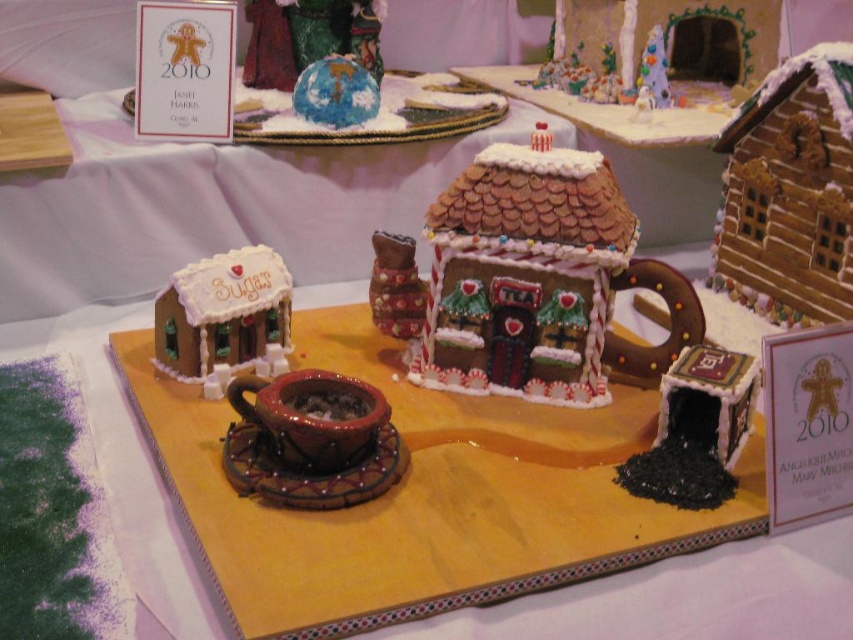
Does white sugary house at lower left appear under matte brown gingerbread house at center?

Yes, white sugary house at lower left is below matte brown gingerbread house at center.

Which of these two, white sugary house at lower left or matte brown gingerbread house at center, stands shorter?

Standing shorter between the two is matte brown gingerbread house at center.

Between point (285, 364) and point (401, 250), which one is positioned behind?

Point (401, 250)

The width and height of the screenshot is (853, 640). Find the location of `white sugary house at lower left`. white sugary house at lower left is located at coordinates (224, 317).

Which is above, glazed gingerbread house at center or matte brown gingerbread house at center?

matte brown gingerbread house at center

Is glazed gingerbread house at center wider than matte brown gingerbread house at center?

Yes.

Locate an element on the screen. glazed gingerbread house at center is located at coordinates (523, 275).

Find the location of a particular element. The width and height of the screenshot is (853, 640). glazed gingerbread house at center is located at coordinates (523, 275).

Is point (492, 220) closer to viewer compared to point (277, 320)?

Yes.

Who is more forward, [598,346] or [199,301]?

Point [199,301] is in front.

Where is `glazed gingerbread house at center`? Image resolution: width=853 pixels, height=640 pixels. glazed gingerbread house at center is located at coordinates (523, 275).